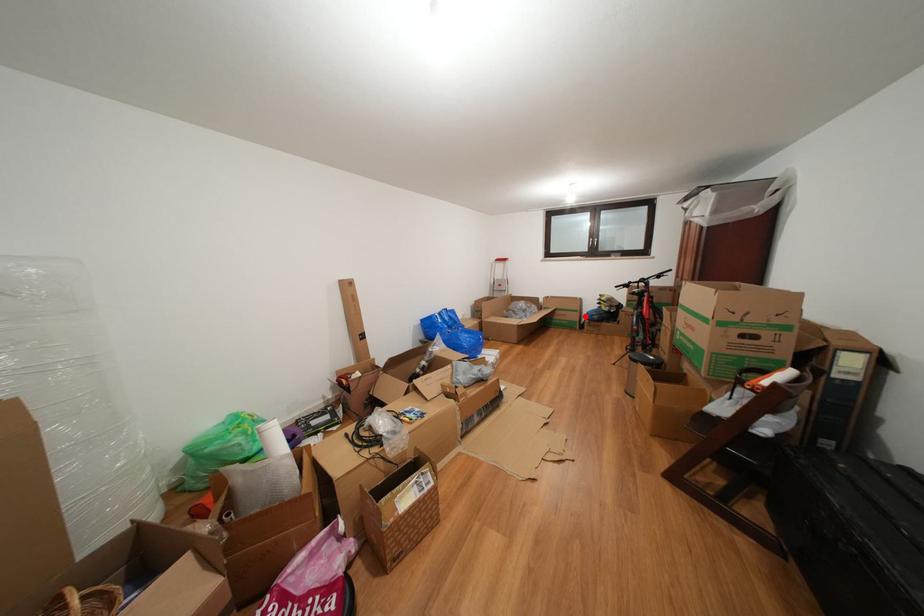
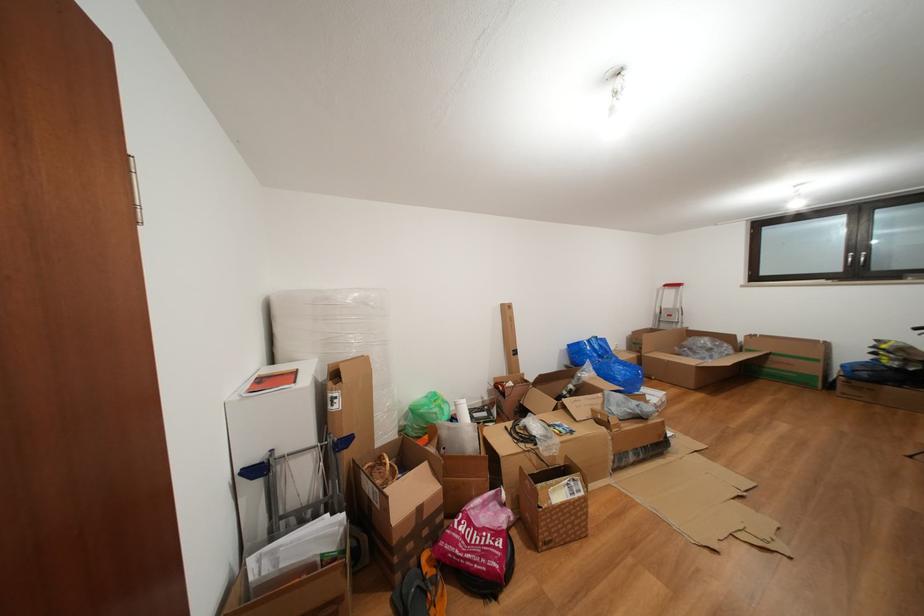
Locate, in the second image, the point that corresponds to the highlighted location in the first image.

(824, 366)